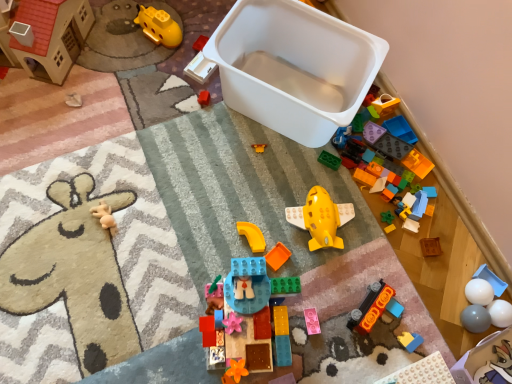
The image size is (512, 384). Identify the location of free space behind beige rubber bear at left, which ranks as the 15th toy in right-to-left order. (120, 165).